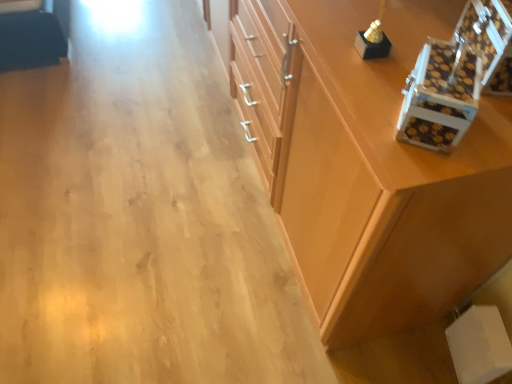
Where is `empty space that is to the right of white textured box at upper right, marked as the 1th box in a left-to-right arrangement`? This screenshot has width=512, height=384. empty space that is to the right of white textured box at upper right, marked as the 1th box in a left-to-right arrangement is located at coordinates (488, 134).